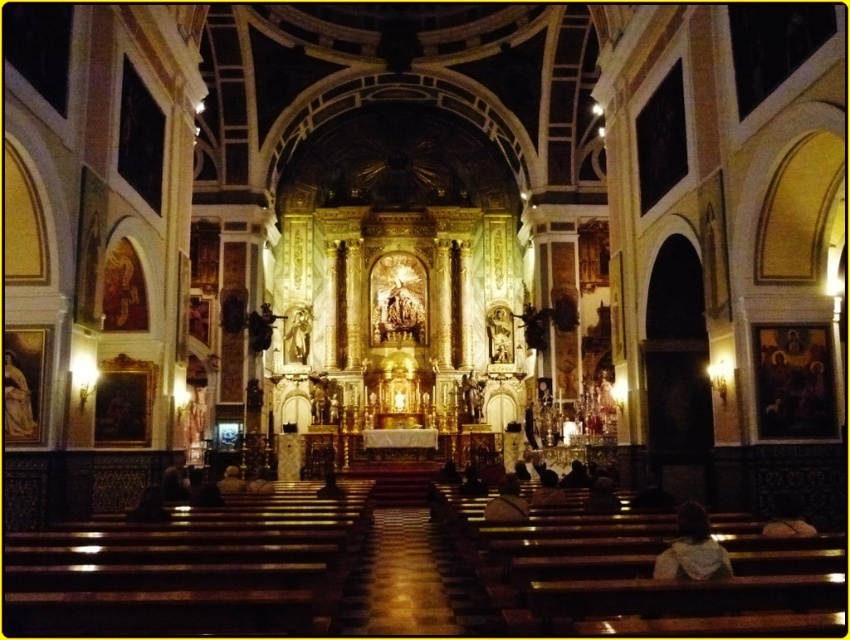
You are standing in the grand church and want to determine the spatial relationship between two points marked in the image. Which of the two points, point (690, 540) or point (558, 496), is closer to you?

Point (690, 540) is closer to the viewer than point (558, 496).

You are a visitor in the church and want to take a photo of the altar. You have two jackets, the light brown leather jacket at lower right and the dark brown leather jacket at lower center. Which jacket is smaller and might be easier to fold and place in your bag?

The light brown leather jacket at lower right has a smaller size compared to the dark brown leather jacket at lower center, so it would be easier to fold and place in your bag.

You are standing inside the grand church and notice two points marked in the scene. The first point is at coordinates point (789, 525) and the second is at point (536, 504). Which of these points is closer to your current position?

Point (789, 525) is closer to the camera than point (536, 504), so the first point is closer to your current position.